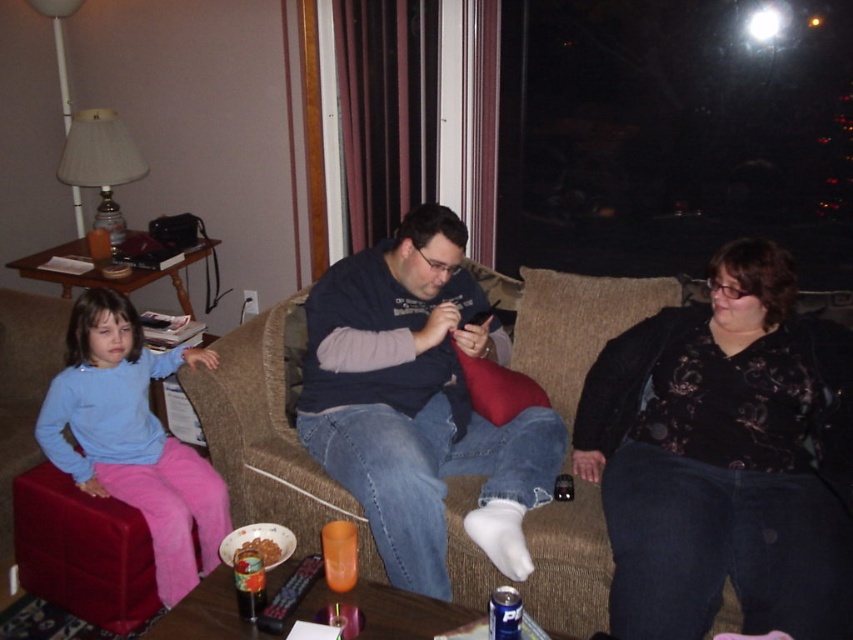
You are a delivery person who needs to place a small package on the brown fabric couch at center. The package is 1 meter wide. Can the black floral sweater at center be moved to make space?

The black floral sweater at center has a lesser width compared to the brown fabric couch at center, so moving it would free up enough space for the 1 meter wide package.

You are a delivery person who needs to place a small package on the couch. The package is the size of the shiny chocolate bar at lower center. Where on the couch can you place it without overlapping the light blue fleece sweater at lower left?

You can place the package on the couch where the shiny chocolate bar at lower center is located, as the light blue fleece sweater at lower left is wider and occupies more space, leaving room for the smaller chocolate bar or package nearby.